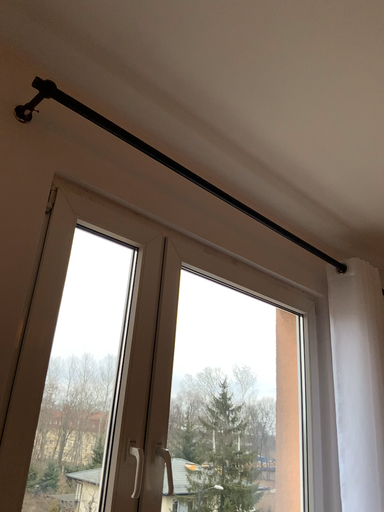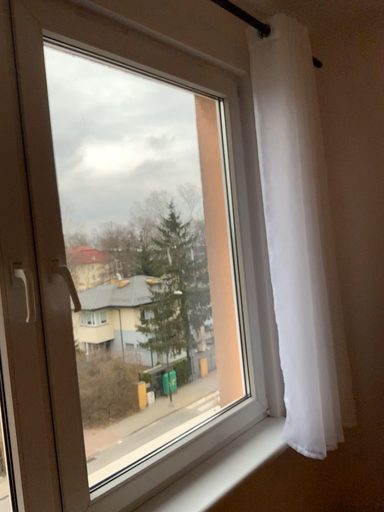
Question: Which way did the camera rotate in the video?

Choices:
 (A) rotated right
 (B) rotated left

Answer: (A)